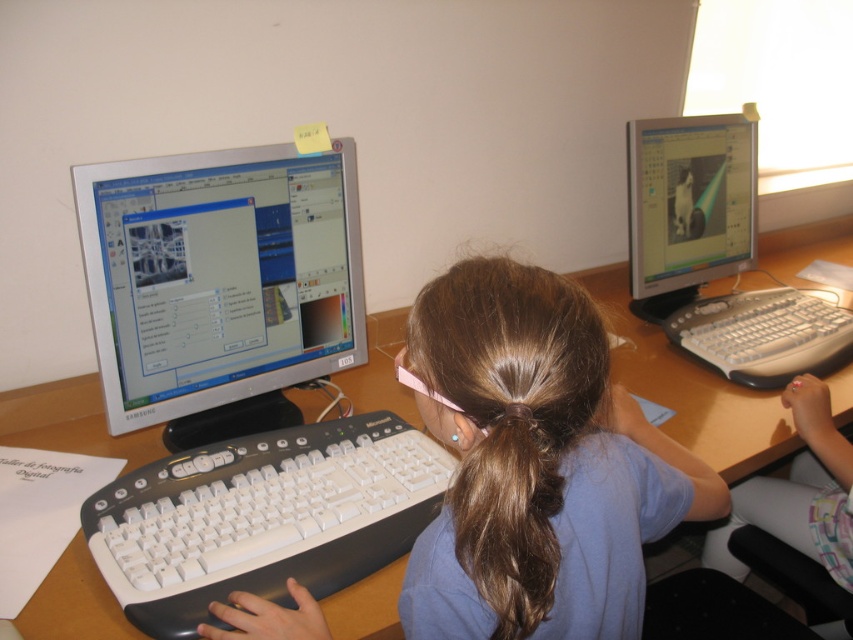
You are a student in the classroom and want to know which object is wider between the matte plastic monitor at upper right and the brown silky hair at center. Can you determine this?

The matte plastic monitor at upper right is wider than the brown silky hair at center.

Looking at this image, you are a student trying to adjust the angle of your desk lamp to better see both the matte plastic monitor at upper right and the brown silky hair at center. Which object should you aim the light towards first to ensure both are illuminated?

The matte plastic monitor at upper right is above the brown silky hair at center, so you should aim the light towards the matte plastic monitor at upper right first to ensure both are illuminated.